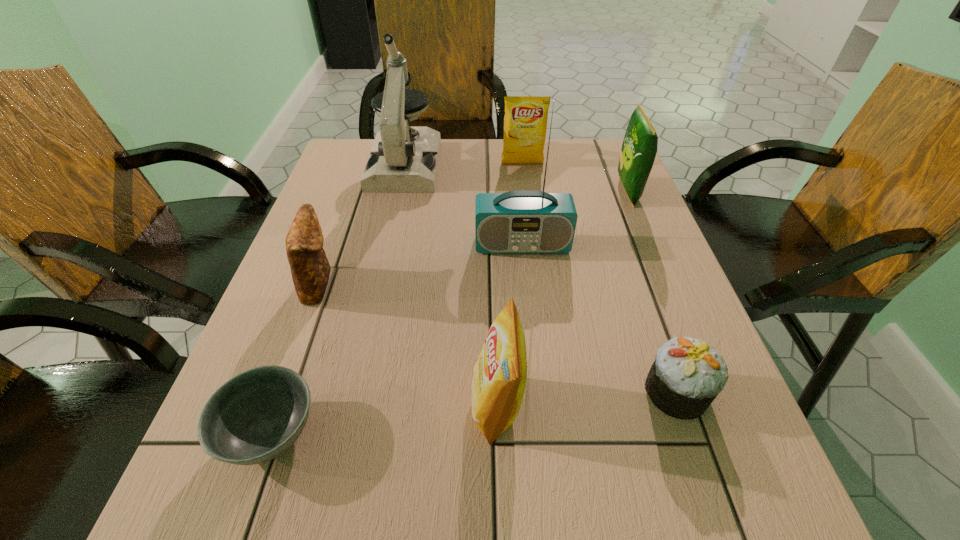
Locate an element on the screen. The image size is (960, 540). free space that satisfies the following two spatial constraints: 1. on the front of the farthest crisp (potato chip) with the logo; 2. on the open side of the fourth nearest object is located at coordinates (538, 284).

The width and height of the screenshot is (960, 540). In order to click on free location that satisfies the following two spatial constraints: 1. on the front panel of the radio receiver; 2. on the left side of the cupcake in this screenshot , I will do click(538, 392).

The width and height of the screenshot is (960, 540). Identify the location of vacant space that satisfies the following two spatial constraints: 1. on the back side of the seventh tallest object; 2. on the open side of the sixth tallest object. (638, 284).